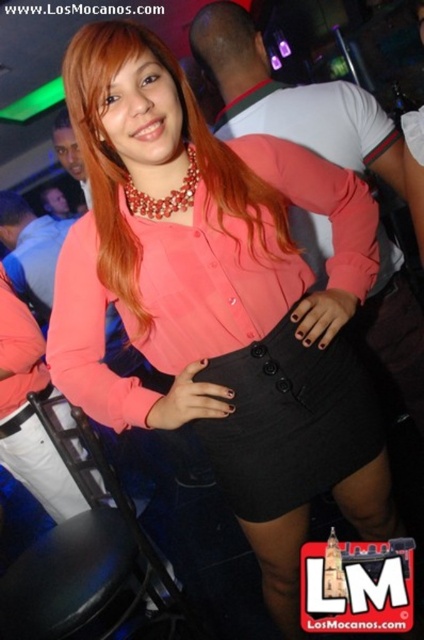
Question: Is black textured skirt at center positioned before blonde silky hair at center?

Choices:
 (A) yes
 (B) no

Answer: (B)

Question: Considering the real-world distances, which object is closest to the black textured skirt at center?

Choices:
 (A) pearl-like beads necklace at center
 (B) blonde silky hair at center

Answer: (B)

Question: Can you confirm if black textured skirt at center is positioned below blonde silky hair at center?

Choices:
 (A) yes
 (B) no

Answer: (A)

Question: Among these objects, which one is nearest to the camera?

Choices:
 (A) pearl-like beads necklace at center
 (B) black textured skirt at center
 (C) blonde silky hair at center

Answer: (C)

Question: Which point is farther to the camera?

Choices:
 (A) (167, 212)
 (B) (113, 216)

Answer: (B)

Question: Can you confirm if blonde silky hair at center is positioned to the right of pearl-like beads necklace at center?

Choices:
 (A) no
 (B) yes

Answer: (B)